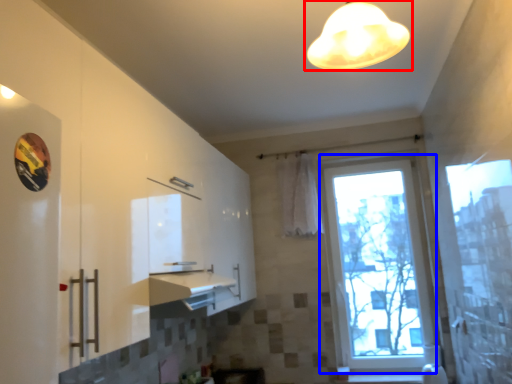
Question: Which point is further to the camera, lamp (highlighted by a red box) or window (highlighted by a blue box)?

Choices:
 (A) lamp
 (B) window

Answer: (B)